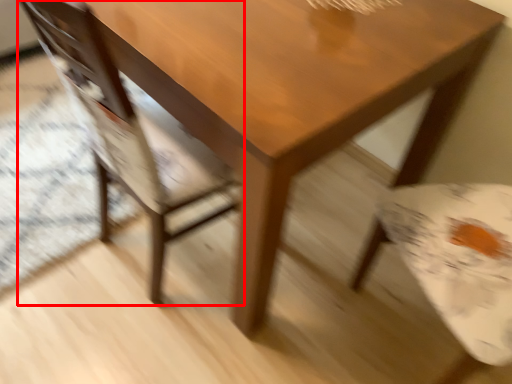
Question: From the image's perspective, what is the correct spatial positioning of chair (annotated by the red box) in reference to table?

Choices:
 (A) below
 (B) above

Answer: (A)